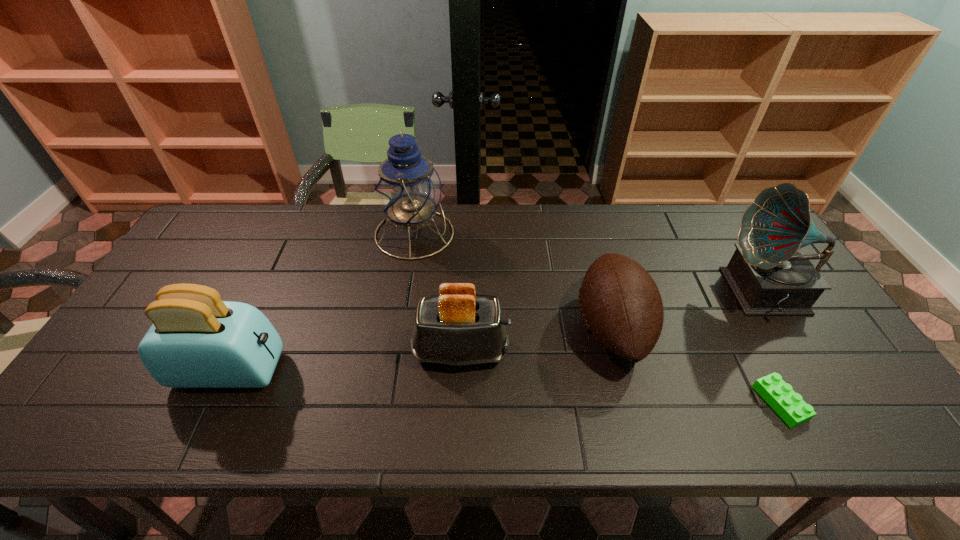
I want to click on blank region between the shortest object and the fourth shortest object, so click(505, 387).

Where is `free point between the third tallest object and the Lego`? This screenshot has height=540, width=960. free point between the third tallest object and the Lego is located at coordinates (505, 387).

Where is `free space between the record player and the lantern`? This screenshot has height=540, width=960. free space between the record player and the lantern is located at coordinates (589, 264).

The width and height of the screenshot is (960, 540). Find the location of `empty space between the lantern and the right toaster`. empty space between the lantern and the right toaster is located at coordinates point(438,292).

At what (x,y) coordinates should I click in order to perform the action: click on free area in between the shorter toaster and the fourth shortest object. Please return your answer as a coordinate pair (x, y). This screenshot has width=960, height=540. Looking at the image, I should click on (346, 361).

Identify which object is the fifth nearest to the lantern. Please provide its 2D coordinates. Your answer should be formatted as a tuple, i.e. [(x, y)], where the tuple contains the x and y coordinates of a point satisfying the conditions above.

[(779, 395)]

Find the location of a particular element. This screenshot has height=540, width=960. the fourth closest object to the Lego is located at coordinates (408, 189).

The height and width of the screenshot is (540, 960). I want to click on vacant region that satisfies the following two spatial constraints: 1. on the side of the shorter toaster with the control lever; 2. on the right side of the Lego, so pos(459,403).

Identify the location of free space in the image that satisfies the following two spatial constraints: 1. on the side of the shorter toaster with the control lever; 2. on the back side of the Lego. (459, 403).

Find the location of a particular element. vacant region that satisfies the following two spatial constraints: 1. on the front-facing side of the farthest object; 2. on the right side of the Lego is located at coordinates (387, 403).